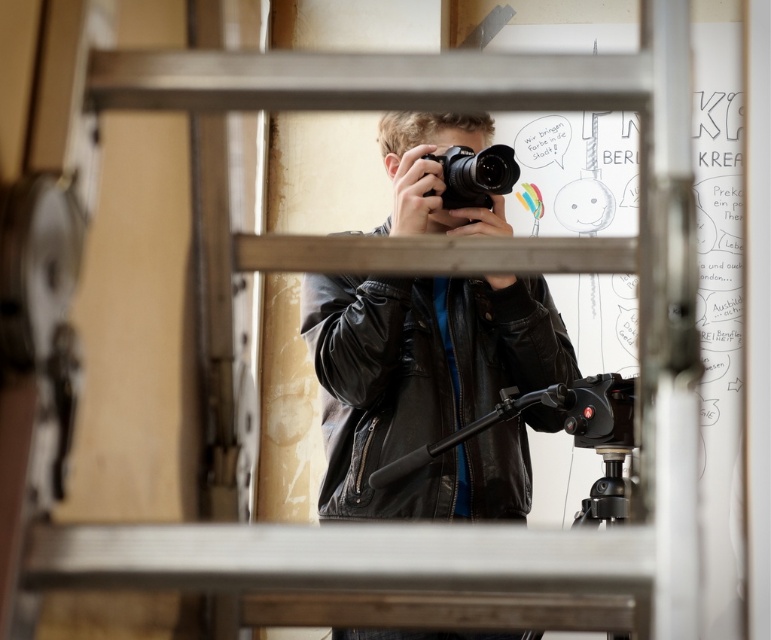
You are a photographer trying to capture a clear shot of the person in the background through the metal grid. The black leather jacket at center and the black matte camera at center are blocking your view. Which object should you move first to get a clearer view?

The black leather jacket at center is positioned under the black matte camera at center. To get a clearer view, you should move the black leather jacket at center first since it is lower and might be blocking the lower part of the person.

You are setting up equipment for a photoshoot. You have a black matte tripod at center and a black matte camera at center. Which one requires more space to place properly?

The black matte tripod at center is bigger than the black matte camera at center, so it requires more space to place properly.

You are standing in front of the metal structure and notice two points marked on it. The first point is at coordinates point (409,428) and the second is at point (564,403). Which point is closer to you?

Point (409,428) is closer to you because it is further to the viewer than point (564,403).